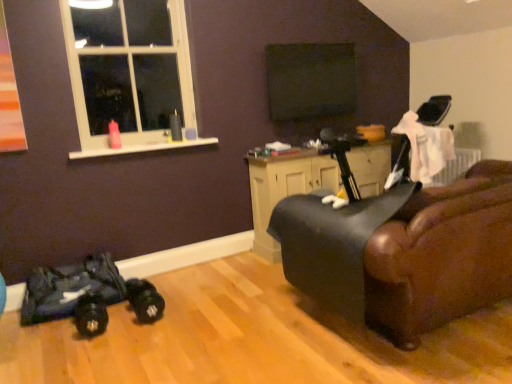
Question: Is black leather swivel chair at right wider or thinner than black matte screen at upper center?

Choices:
 (A) thin
 (B) wide

Answer: (B)

Question: Based on their sizes in the image, would you say black leather swivel chair at right is bigger or smaller than black matte screen at upper center?

Choices:
 (A) small
 (B) big

Answer: (B)

Question: Based on their relative distances, which object is nearer to the black matte screen at upper center?

Choices:
 (A) black leather swivel chair at right
 (B) black leather chair at right
 (C) white plastic window at upper left
 (D) matte black cabinet at center

Answer: (D)

Question: Considering the real-world distances, which object is farthest from the black leather swivel chair at right?

Choices:
 (A) black leather chair at right
 (B) matte black cabinet at center
 (C) white plastic window at upper left
 (D) black matte screen at upper center

Answer: (C)